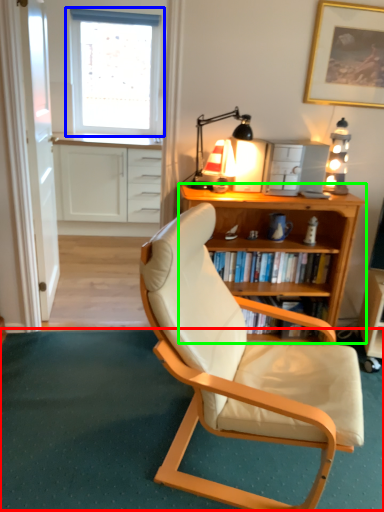
Question: Which object is the farthest from plain (highlighted by a red box)? Choose among these: window (highlighted by a blue box) or desk (highlighted by a green box).

Choices:
 (A) window
 (B) desk

Answer: (A)